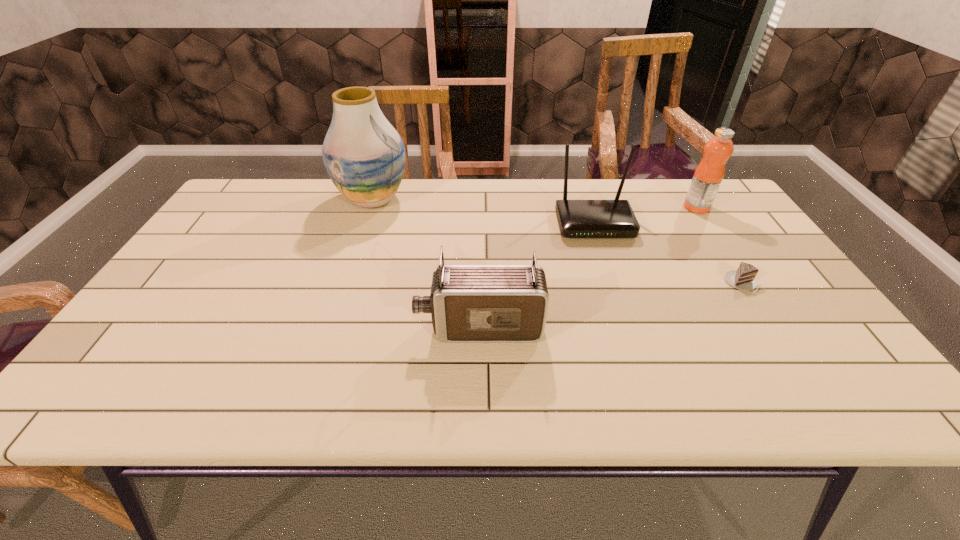
Identify the location of object that is positioned at the far right corner. (709, 174).

Locate an element on the screen. vacant region at the far edge of the desktop is located at coordinates (611, 188).

At what (x,y) coordinates should I click in order to perform the action: click on blank space at the near edge. Please return your answer as a coordinate pair (x, y). Image resolution: width=960 pixels, height=540 pixels. Looking at the image, I should click on (182, 392).

Identify the location of blank space at the left edge of the desktop. The width and height of the screenshot is (960, 540). (135, 353).

Where is `free region at the right edge of the desktop`? This screenshot has width=960, height=540. free region at the right edge of the desktop is located at coordinates (823, 322).

At what (x,y) coordinates should I click in order to perform the action: click on blank space at the far left corner. Please return your answer as a coordinate pair (x, y). Image resolution: width=960 pixels, height=540 pixels. Looking at the image, I should click on (260, 197).

This screenshot has width=960, height=540. What are the coordinates of `vacant area at the far right corner of the desktop` in the screenshot? It's located at (679, 201).

I want to click on free space that is in between the fruit juice and the chocolate cake, so click(719, 245).

You are a GUI agent. You are given a task and a screenshot of the screen. Output one action in this format:
    pyautogui.click(x=<x>, y=<y>)
    Task: Click on the vacant region between the router and the shortest object
    The image size is (960, 540).
    Given the screenshot: What is the action you would take?
    pyautogui.click(x=668, y=253)

The image size is (960, 540). Identify the location of vacant area that lies between the leftmost object and the shortest object. (558, 241).